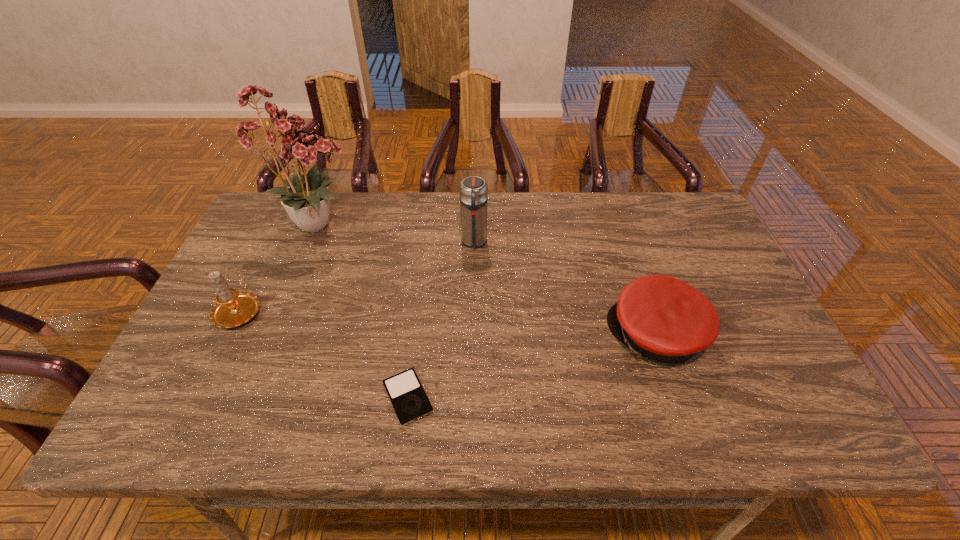
You are a GUI agent. You are given a task and a screenshot of the screen. Output one action in this format:
    pyautogui.click(x=<x>, y=<y>)
    Task: Click on the vacant space located on the front of the candle
    The width and height of the screenshot is (960, 540).
    Given the screenshot: What is the action you would take?
    208,375

Identify the location of blank area located 0.340m at the front of the rightmost object where the visor is located. Image resolution: width=960 pixels, height=540 pixels. (472, 336).

You are a GUI agent. You are given a task and a screenshot of the screen. Output one action in this format:
    pyautogui.click(x=<x>, y=<y>)
    Task: Click on the vacant region located at the front of the rightmost object where the visor is located
    
    Given the screenshot: What is the action you would take?
    pyautogui.click(x=573, y=336)

Identify the location of vacant space located at the front of the rightmost object where the visor is located. (565, 336).

Locate an element on the screen. The image size is (960, 540). vacant space situated on the left of the shortest object is located at coordinates (273, 397).

Identify the location of flower arrangement positioned at the far edge. coord(307,199).

Identify the location of thermos bottle located in the far edge section of the desktop. This screenshot has height=540, width=960. (473, 190).

In order to click on object positioned at the near edge in this screenshot , I will do tap(406, 393).

At what (x,y) coordinates should I click in order to perform the action: click on flower arrangement at the left edge. Please return your answer as a coordinate pair (x, y). This screenshot has width=960, height=540. Looking at the image, I should click on (307, 199).

Locate an element on the screen. This screenshot has height=540, width=960. candle that is at the left edge is located at coordinates (233, 308).